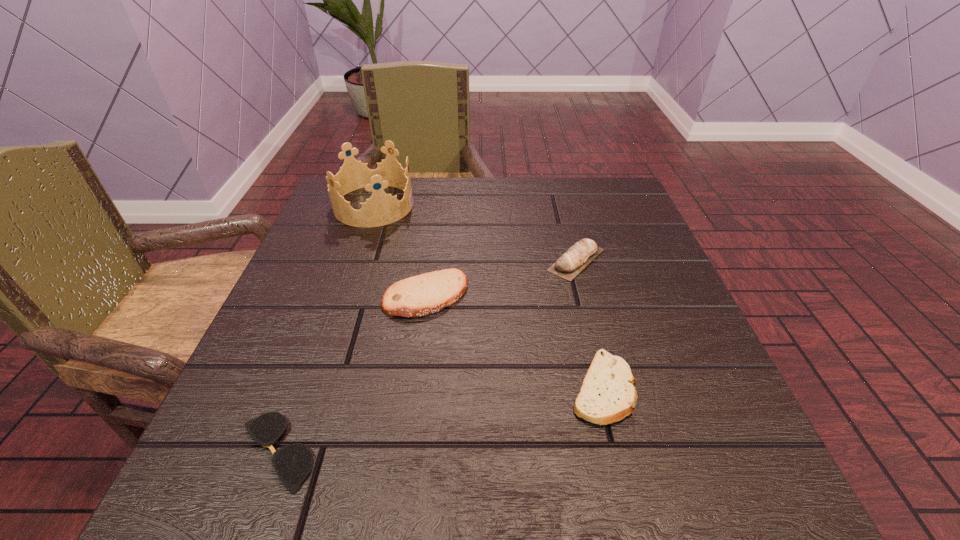
The image size is (960, 540). Find the location of `object that is positioned at the far edge`. object that is positioned at the far edge is located at coordinates (380, 209).

This screenshot has width=960, height=540. I want to click on object that is at the near edge, so click(x=293, y=463).

You are a GUI agent. You are given a task and a screenshot of the screen. Output one action in this format:
    pyautogui.click(x=<x>, y=<y>)
    Task: Click on the tiara at the left edge
    This screenshot has height=540, width=960.
    Given the screenshot: What is the action you would take?
    pyautogui.click(x=380, y=209)

Where is `spectacles located in the left edge section of the desktop`? spectacles located in the left edge section of the desktop is located at coordinates (293, 463).

Locate an element on the screen. The image size is (960, 540). object that is positioned at the far left corner is located at coordinates (380, 209).

I want to click on object that is at the near left corner, so click(x=293, y=463).

Image resolution: width=960 pixels, height=540 pixels. In the image, there is a desktop. What are the coordinates of `vacant region at the far edge` in the screenshot? It's located at (x=467, y=180).

In the image, there is a desktop. Find the location of `free space at the near edge`. free space at the near edge is located at coordinates (354, 451).

Where is `vacant space at the left edge of the desktop`? vacant space at the left edge of the desktop is located at coordinates (290, 360).

Find the location of a particular element. The height and width of the screenshot is (540, 960). vacant space at the right edge is located at coordinates (640, 294).